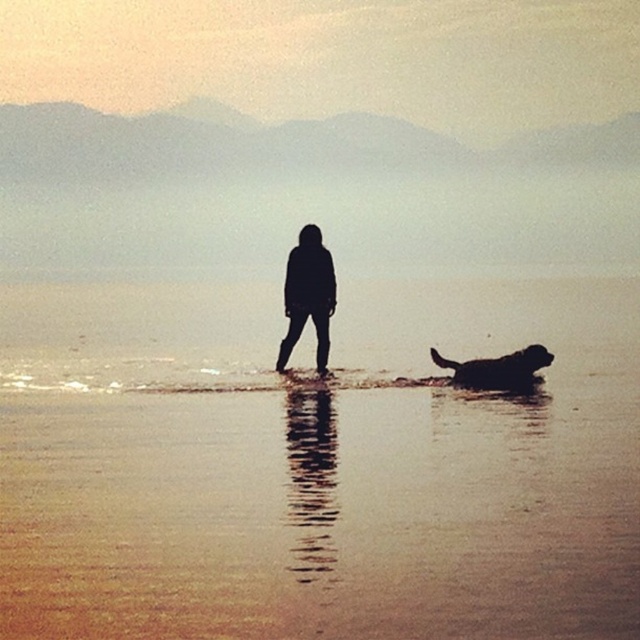
Question: Which point is closer to the camera?

Choices:
 (A) (625, 634)
 (B) (298, 305)

Answer: (A)

Question: Is smooth sand water at center positioned behind black matte dog at lower right?

Choices:
 (A) no
 (B) yes

Answer: (A)

Question: Which point is closer to the camera?

Choices:
 (A) black matte figure at center
 (B) smooth sand water at center

Answer: (B)

Question: From the image, what is the correct spatial relationship of black matte figure at center in relation to black matte dog at lower right?

Choices:
 (A) right
 (B) left

Answer: (B)

Question: Does smooth sand water at center have a smaller size compared to black matte dog at lower right?

Choices:
 (A) yes
 (B) no

Answer: (B)

Question: Which of the following is the farthest from the observer?

Choices:
 (A) [404, 529]
 (B) [467, 387]
 (C) [314, 316]

Answer: (C)